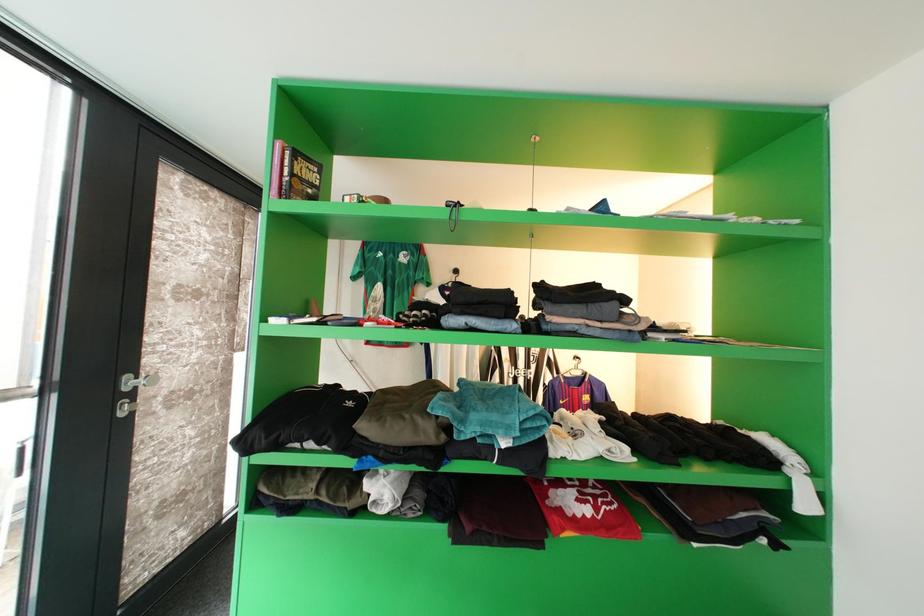
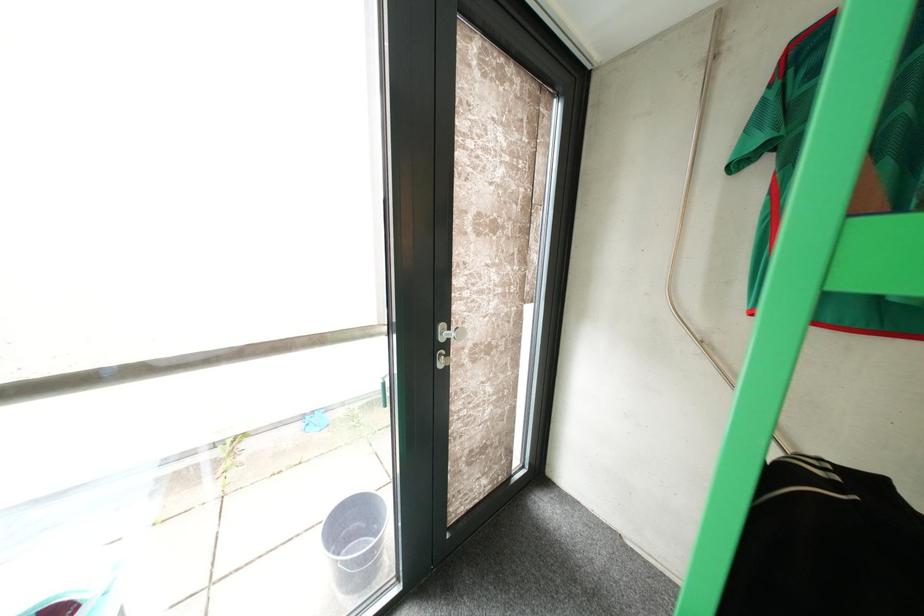
Question: The first image is from the beginning of the video and the second image is from the end. How did the camera likely rotate when shooting the video?

Choices:
 (A) Left
 (B) Right
 (C) Up
 (D) Down

Answer: (A)